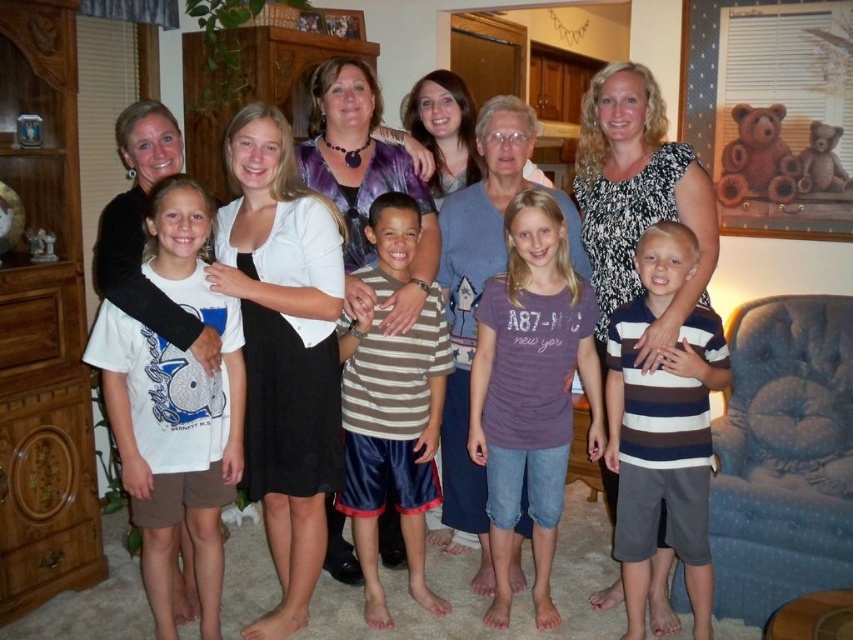
You are organizing a photoshoot and need to ensure that the white matte cardigan at center and the striped fabric shorts at center are both visible in the final image. Based on their positions, which clothing item is closer to the camera?

The white matte cardigan at center is closer to the camera because it is in front of the striped fabric shorts at center.